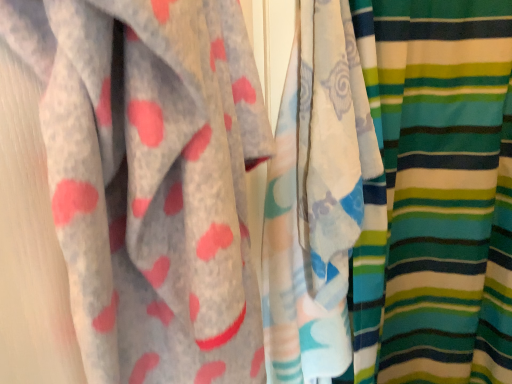
Question: Is white cotton towel at center, acting as the second curtain starting from the right, not near striped fabric at right, which ranks as the 1th curtain in right-to-left order?

Choices:
 (A) yes
 (B) no

Answer: (B)

Question: Is white cotton towel at center, acting as the second curtain starting from the right, aimed at striped fabric at right, marked as the second curtain in a left-to-right arrangement?

Choices:
 (A) no
 (B) yes

Answer: (B)

Question: From the image's perspective, would you say white cotton towel at center, acting as the second curtain starting from the right, is shown under striped fabric at right, which ranks as the 1th curtain in right-to-left order?

Choices:
 (A) no
 (B) yes

Answer: (A)

Question: Is white cotton towel at center, positioned as the first curtain in left-to-right order, in contact with striped fabric at right, which ranks as the 1th curtain in right-to-left order?

Choices:
 (A) no
 (B) yes

Answer: (A)

Question: Does white cotton towel at center, positioned as the first curtain in left-to-right order, have a greater height compared to striped fabric at right, which ranks as the 1th curtain in right-to-left order?

Choices:
 (A) yes
 (B) no

Answer: (B)

Question: Is white cotton towel at center, acting as the second curtain starting from the right, bigger than striped fabric at right, which ranks as the 1th curtain in right-to-left order?

Choices:
 (A) no
 (B) yes

Answer: (A)

Question: From a real-world perspective, is striped fabric at right, which ranks as the 1th curtain in right-to-left order, physically above white cotton towel at center, acting as the second curtain starting from the right?

Choices:
 (A) yes
 (B) no

Answer: (B)

Question: From a real-world perspective, is striped fabric at right, marked as the second curtain in a left-to-right arrangement, below white cotton towel at center, positioned as the first curtain in left-to-right order?

Choices:
 (A) yes
 (B) no

Answer: (A)

Question: Considering the relative sizes of striped fabric at right, which ranks as the 1th curtain in right-to-left order, and white cotton towel at center, positioned as the first curtain in left-to-right order, in the image provided, is striped fabric at right, which ranks as the 1th curtain in right-to-left order, thinner than white cotton towel at center, positioned as the first curtain in left-to-right order,?

Choices:
 (A) no
 (B) yes

Answer: (A)

Question: Is white cotton towel at center, acting as the second curtain starting from the right, surrounded by striped fabric at right, marked as the second curtain in a left-to-right arrangement?

Choices:
 (A) yes
 (B) no

Answer: (A)

Question: Considering the relative positions of striped fabric at right, which ranks as the 1th curtain in right-to-left order, and white cotton towel at center, acting as the second curtain starting from the right, in the image provided, is striped fabric at right, which ranks as the 1th curtain in right-to-left order, in front of white cotton towel at center, acting as the second curtain starting from the right,?

Choices:
 (A) yes
 (B) no

Answer: (B)

Question: Is striped fabric at right, which ranks as the 1th curtain in right-to-left order, wider than white cotton towel at center, acting as the second curtain starting from the right?

Choices:
 (A) yes
 (B) no

Answer: (A)

Question: Is point [332, 241] positioned closer to the camera than point [499, 226]?

Choices:
 (A) farther
 (B) closer

Answer: (B)